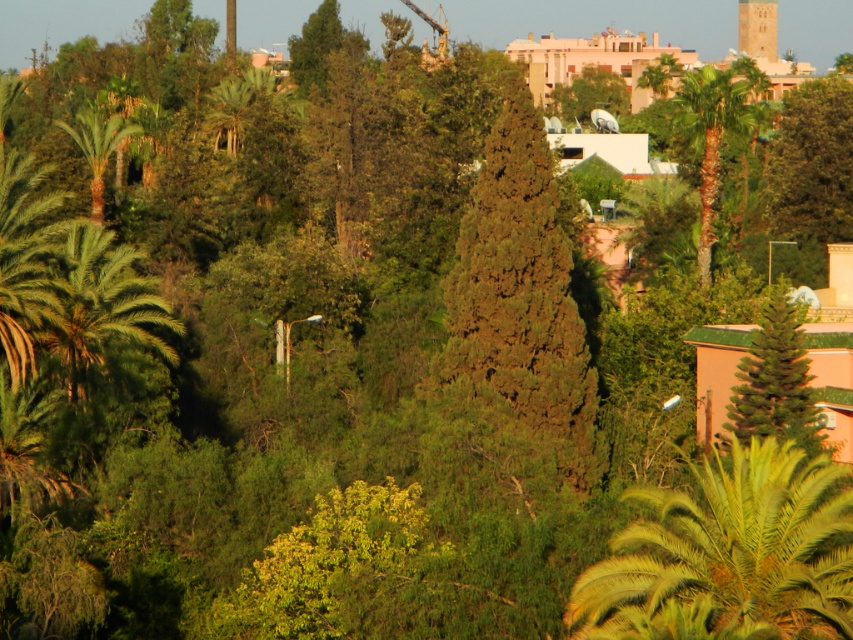
Question: Considering the relative positions of green leafy palm tree at lower right and green textured tree at right in the image provided, where is green leafy palm tree at lower right located with respect to green textured tree at right?

Choices:
 (A) left
 (B) right

Answer: (A)

Question: Is green textured tree at center to the left of green leafy palm tree at upper right from the viewer's perspective?

Choices:
 (A) no
 (B) yes

Answer: (B)

Question: Which point is farther to the camera?

Choices:
 (A) (756, 17)
 (B) (100, 120)

Answer: (A)

Question: Among these points, which one is nearest to the camera?

Choices:
 (A) (749, 26)
 (B) (781, 360)
 (C) (641, 596)
 (D) (102, 168)

Answer: (C)

Question: Does green textured tree at right have a larger size compared to green leafy palm tree at upper right?

Choices:
 (A) no
 (B) yes

Answer: (A)

Question: Which is nearer to the green textured tree at right?

Choices:
 (A) green leafy palm tree at upper right
 (B) green leafy palm tree at lower right
 (C) smooth stone tower at upper right

Answer: (B)